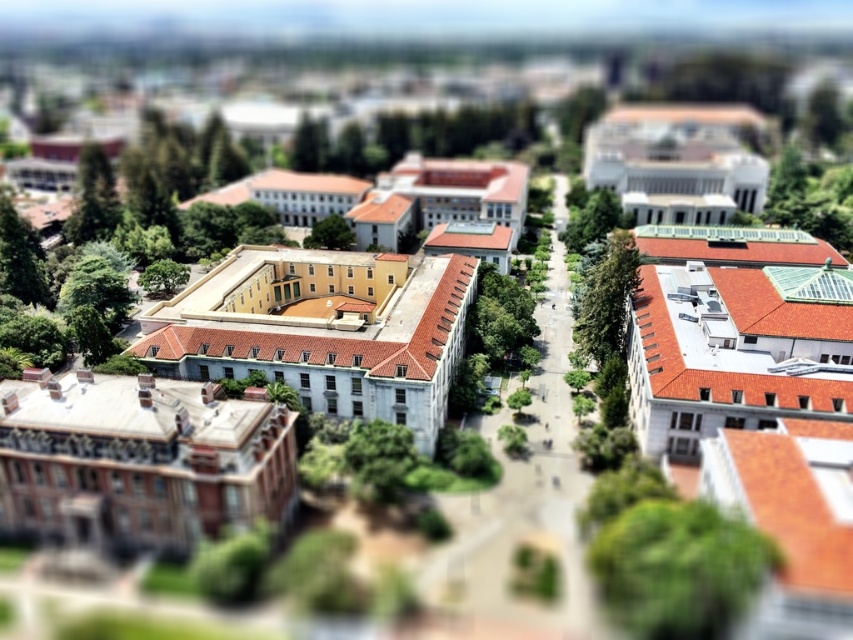
Between green leafy tree at lower right and green leafy tree at center, which one is positioned lower?

green leafy tree at lower right is below.

Between green leafy tree at lower right and green leafy tree at center, which one has more height?

With more height is green leafy tree at center.

Between point (665, 513) and point (346, 234), which one is positioned in front?

Point (665, 513) is more forward.

Where is `green leafy tree at lower right`? This screenshot has height=640, width=853. green leafy tree at lower right is located at coordinates (677, 566).

Who is more distant from viewer, (648, 563) or (589, 292)?

The point (589, 292) is more distant.

This screenshot has height=640, width=853. What are the coordinates of `green leafy tree at lower right` in the screenshot? It's located at (677, 566).

How much distance is there between green leafy tree at center-right and green leafy tree at center?

green leafy tree at center-right and green leafy tree at center are 66.47 meters apart from each other.

Which is in front, point (601, 275) or point (335, 216)?

Positioned in front is point (601, 275).

This screenshot has width=853, height=640. Identify the location of green leafy tree at center-right. (606, 298).